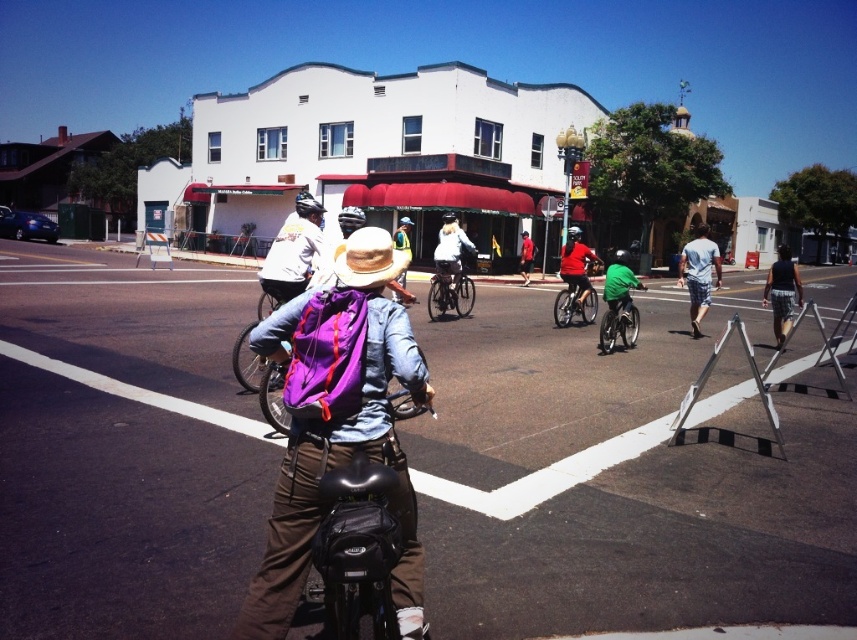
Question: Among these objects, which one is nearest to the camera?

Choices:
 (A) reflective yellow vest at center
 (B) white matte jacket at center
 (C) matte purple backpack at center

Answer: (C)

Question: Among these objects, which one is nearest to the camera?

Choices:
 (A) strawmaterial/texturehat at center
 (B) shiny metallic bicycle at center
 (C) shiny silver bicycle at center
 (D) green matte bicycle at center

Answer: (A)

Question: Estimate the real-world distances between objects in this image. Which object is closer to the green matte bicycle at center?

Choices:
 (A) purple fabric backpack at center
 (B) shiny silver bicycle at center
 (C) strawmaterial/texturehat at center

Answer: (B)

Question: Can you confirm if purple fabric backpack at center is smaller than reflective yellow vest at center?

Choices:
 (A) yes
 (B) no

Answer: (A)

Question: Is purple fabric backpack at center behind strawmaterial/texturehat at center?

Choices:
 (A) yes
 (B) no

Answer: (B)

Question: Is purple fabric backpack at center bigger than reflective yellow vest at center?

Choices:
 (A) no
 (B) yes

Answer: (A)